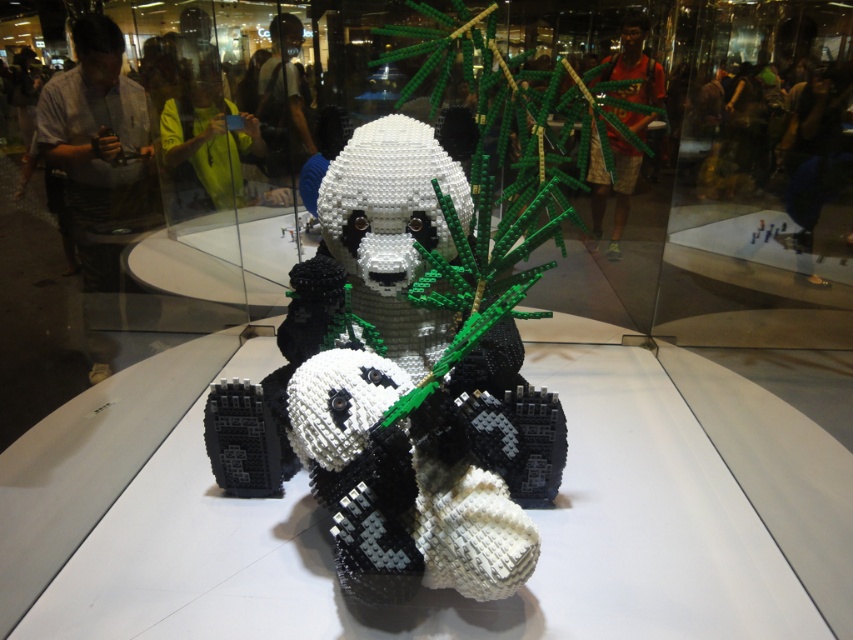
You are a visitor standing in front of the LEGO panda sculpture. You notice two panda figures at the center. Which panda is closer to you, the white matte lego panda at center or the black matte lego panda at center?

The white matte lego panda at center is closer to you because it is positioned in front of the black matte lego panda at center.

You are standing in front of the LEGO panda sculpture and notice two points marked on the glass enclosure. The first point is at coordinate point (514, 433) and the second is at point (450, 493). Which point is closer to you?

Point (450, 493) is closer to you because it is in front of point (514, 433) according to their spatial relationship.

You are a LEGO designer observing the sculpture. You need to place both the white matte lego panda at center and the black matte lego panda at center on a shelf that can only accommodate one of them. Which panda should you choose based on their widths?

The white matte lego panda at center is wider than the black matte lego panda at center. Therefore, you should choose the white matte lego panda at center to place on the shelf since it requires more space.